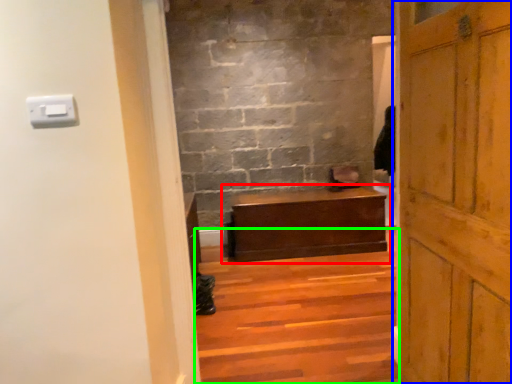
Question: Which is farther away from table (highlighted by a red box)? door (highlighted by a blue box) or stairs (highlighted by a green box)?

Choices:
 (A) door
 (B) stairs

Answer: (A)